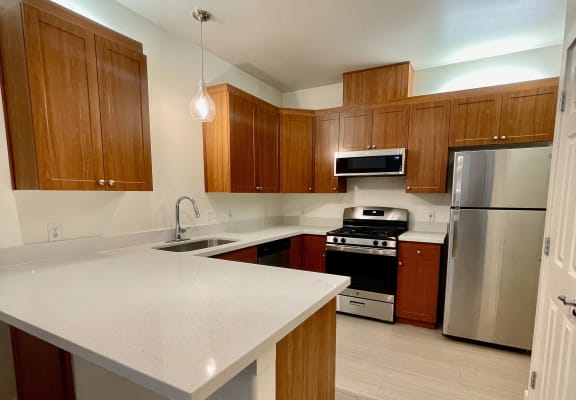
The image size is (576, 400). I want to click on sink, so click(195, 244).